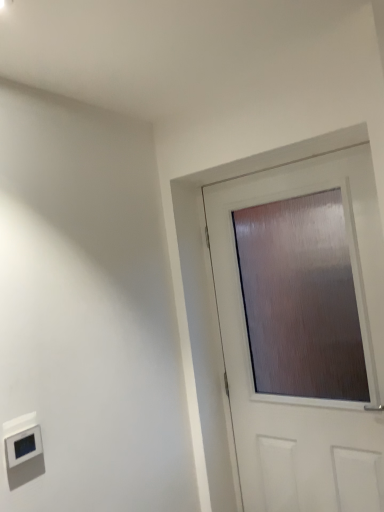
What is the approximate width of matte white thermostat at lower left?

0.91 inches.

This screenshot has width=384, height=512. I want to click on matte white thermostat at lower left, so click(24, 445).

This screenshot has width=384, height=512. Describe the element at coordinates (24, 445) in the screenshot. I see `matte white thermostat at lower left` at that location.

Measure the distance between point (211, 225) and camera.

The distance of point (211, 225) from camera is 6.97 feet.

The height and width of the screenshot is (512, 384). Describe the element at coordinates (305, 392) in the screenshot. I see `matte brown door at center` at that location.

What are the coordinates of `matte brown door at center` in the screenshot? It's located at (305, 392).

The image size is (384, 512). What are the coordinates of `matte white thermostat at lower left` in the screenshot? It's located at (24, 445).

Which is more to the left, matte white thermostat at lower left or matte brown door at center?

Positioned to the left is matte white thermostat at lower left.

Does matte white thermostat at lower left lie behind matte brown door at center?

No, matte white thermostat at lower left is closer to the camera.

Is point (26, 445) closer to camera compared to point (229, 369)?

Yes, point (26, 445) is closer to viewer.

From the image's perspective, is matte white thermostat at lower left over matte brown door at center?

No, from the image's perspective, matte white thermostat at lower left is not over matte brown door at center.

From a real-world perspective, which is physically above, matte white thermostat at lower left or matte brown door at center?

matte brown door at center, from a real-world perspective.

Consider the image. Which object is thinner, matte white thermostat at lower left or matte brown door at center?

matte brown door at center.

Can you confirm if matte white thermostat at lower left is taller than matte brown door at center?

Incorrect, the height of matte white thermostat at lower left is not larger of that of matte brown door at center.

Considering the sizes of objects matte white thermostat at lower left and matte brown door at center in the image provided, who is smaller, matte white thermostat at lower left or matte brown door at center?

matte white thermostat at lower left.

Is matte white thermostat at lower left positioned beyond the bounds of matte brown door at center?

Yes, matte white thermostat at lower left is located beyond the bounds of matte brown door at center.

Is matte white thermostat at lower left touching matte brown door at center?

No, matte white thermostat at lower left is not beside matte brown door at center.

Could you tell me if matte white thermostat at lower left is turned towards matte brown door at center?

No, matte white thermostat at lower left is not facing towards matte brown door at center.

Where is `door to the right of matte white thermostat at lower left`? door to the right of matte white thermostat at lower left is located at coordinates (305, 392).

Is matte brown door at center to the left or to the right of matte white thermostat at lower left in the image?

Clearly, matte brown door at center is on the right of matte white thermostat at lower left in the image.

Is matte brown door at center positioned in front of matte white thermostat at lower left?

That is False.

Is point (379, 279) closer or farther from the camera than point (28, 440)?

Clearly, point (379, 279) is more distant from the camera than point (28, 440).

From the image's perspective, is matte brown door at center above matte white thermostat at lower left?

Yes, from the image's perspective, matte brown door at center is above matte white thermostat at lower left.

From a real-world perspective, which object rests below the other?

matte white thermostat at lower left is physically lower.

Between matte brown door at center and matte white thermostat at lower left, which one has smaller width?

matte brown door at center is thinner.

Which of these two, matte brown door at center or matte white thermostat at lower left, stands shorter?

With less height is matte white thermostat at lower left.

Looking at this image, between matte brown door at center and matte white thermostat at lower left, which one has larger size?

With larger size is matte brown door at center.

Would you say matte brown door at center is outside matte white thermostat at lower left?

Absolutely, matte brown door at center is external to matte white thermostat at lower left.

Is matte brown door at center placed right next to matte white thermostat at lower left?

matte brown door at center and matte white thermostat at lower left are clearly separated.

Is matte white thermostat at lower left at the back of matte brown door at center?

matte brown door at center is not turned away from matte white thermostat at lower left.

Locate an element on the screen. This screenshot has height=512, width=384. door above the matte white thermostat at lower left (from the image's perspective) is located at coordinates (305, 392).

Where is `door above the matte white thermostat at lower left (from the image's perspective)`? Image resolution: width=384 pixels, height=512 pixels. door above the matte white thermostat at lower left (from the image's perspective) is located at coordinates (305, 392).

Where is `light switch directly beneath the matte brown door at center (from a real-world perspective)`? This screenshot has height=512, width=384. light switch directly beneath the matte brown door at center (from a real-world perspective) is located at coordinates (24, 445).